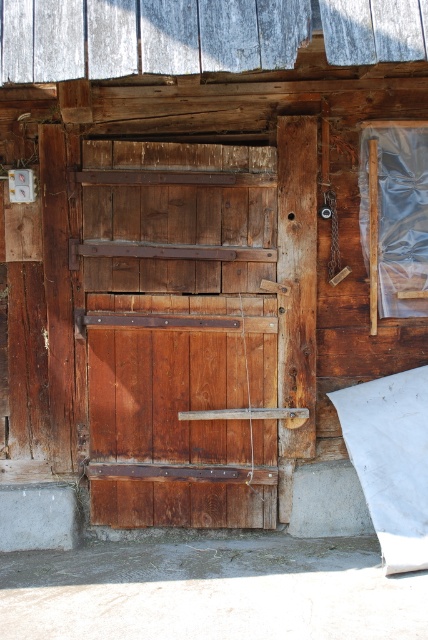
You are standing in front of a rustic wooden door. There is a point marked at coordinates (178,330). Based on the scene description, can you identify what object this point is pointing to?

The point at coordinates (178,330) corresponds to the rustic wood barn door at center.

You are standing in front of a rustic wooden structure and see the rustic wood barn door at center and the rustic wood door at center. Which door is positioned to the left?

The rustic wood barn door at center is positioned to the left of the rustic wood door at center.